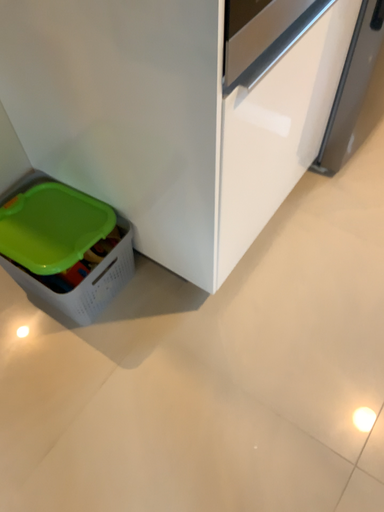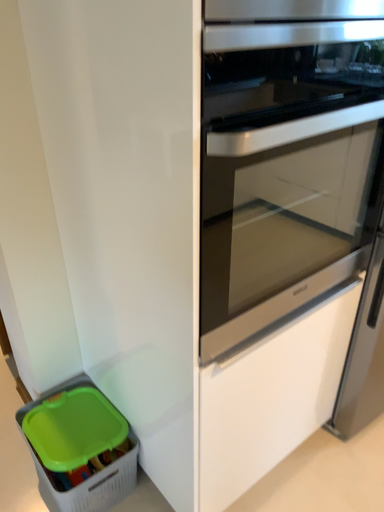
Question: Which way did the camera rotate in the video?

Choices:
 (A) rotated upward
 (B) rotated downward

Answer: (A)